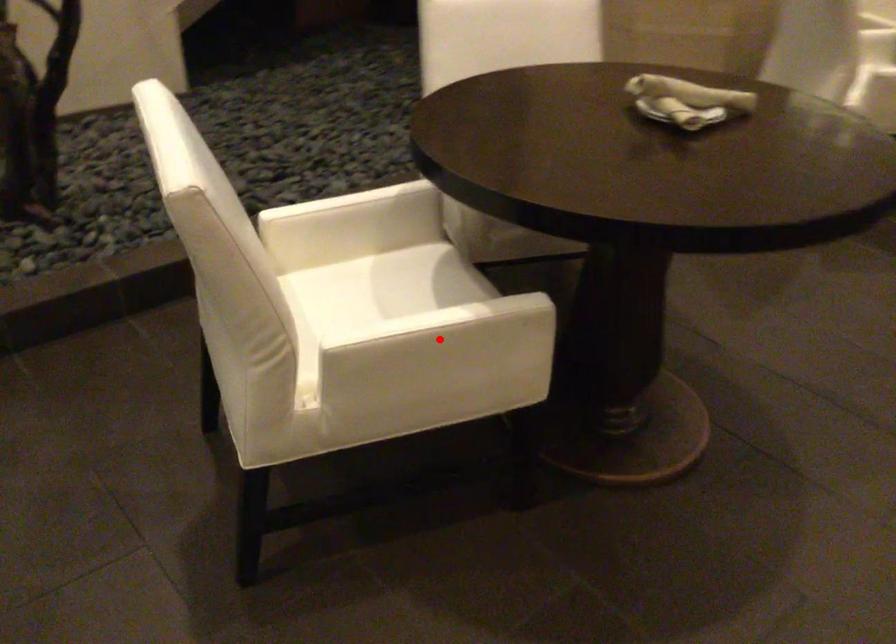
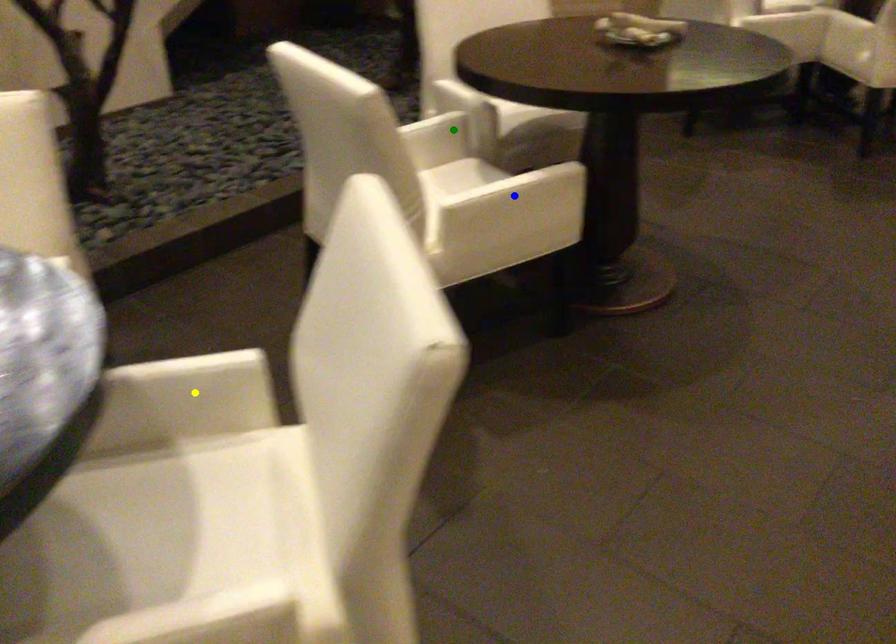
Question: I am providing you with two images of the same scene from different viewpoints. A red point is marked on the first image. You are given multiple points on the second image. Which spot in image 2 lines up with the point in image 1?

Choices:
 (A) blue point
 (B) yellow point
 (C) green point

Answer: (A)